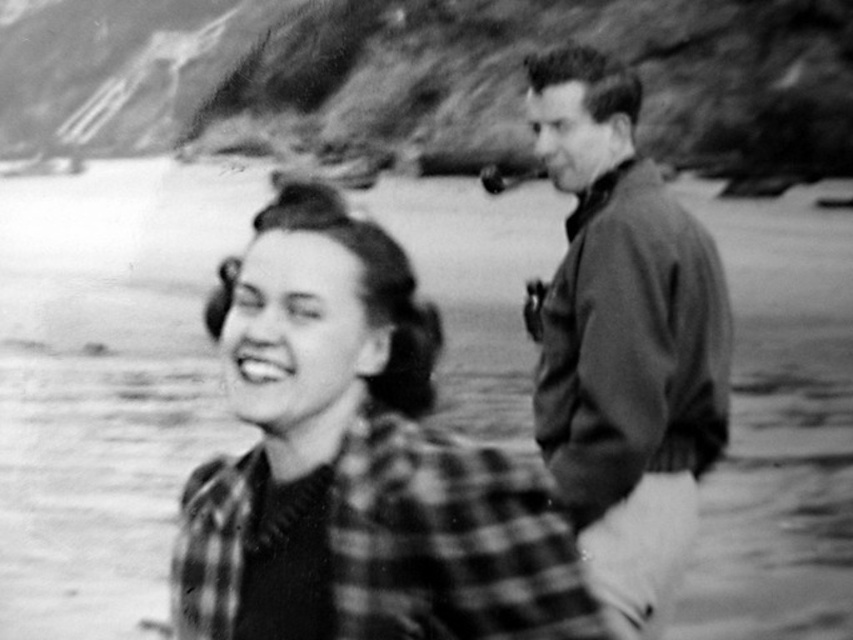
Question: Is the position of plaid fabric shirt at center more distant than that of dark brown leather jacket at right?

Choices:
 (A) no
 (B) yes

Answer: (A)

Question: Which point is closer to the camera?

Choices:
 (A) pos(653,237)
 (B) pos(309,593)

Answer: (B)

Question: Does plaid fabric shirt at center have a lesser width compared to dark brown leather jacket at right?

Choices:
 (A) no
 (B) yes

Answer: (A)

Question: Is plaid fabric shirt at center smaller than dark brown leather jacket at right?

Choices:
 (A) yes
 (B) no

Answer: (B)

Question: Which of the following is the farthest from the observer?

Choices:
 (A) plaid fabric shirt at center
 (B) dark brown leather jacket at right

Answer: (B)

Question: Which point is closer to the camera?

Choices:
 (A) (599, 634)
 (B) (643, 624)

Answer: (A)